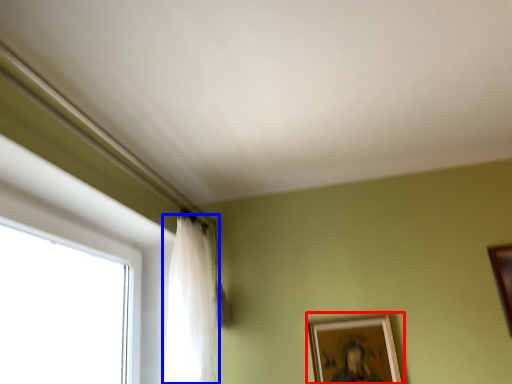
Question: Which object is closer to the camera taking this photo, picture frame (highlighted by a red box) or curtain (highlighted by a blue box)?

Choices:
 (A) picture frame
 (B) curtain

Answer: (B)